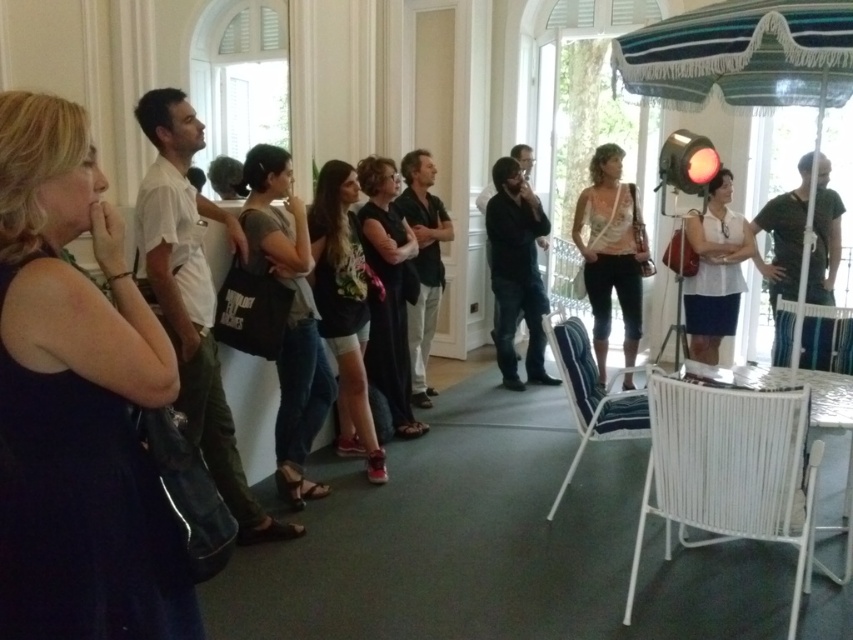
From the picture: Can you confirm if light beige fabric purse at center is positioned below white fabric dress at center?

No.

Which is in front, point (601, 342) or point (711, 276)?

Point (711, 276) is in front.

Is point (610, 305) positioned behind point (703, 292)?

Yes, point (610, 305) is farther from viewer.

Locate an element on the screen. light beige fabric purse at center is located at coordinates (610, 252).